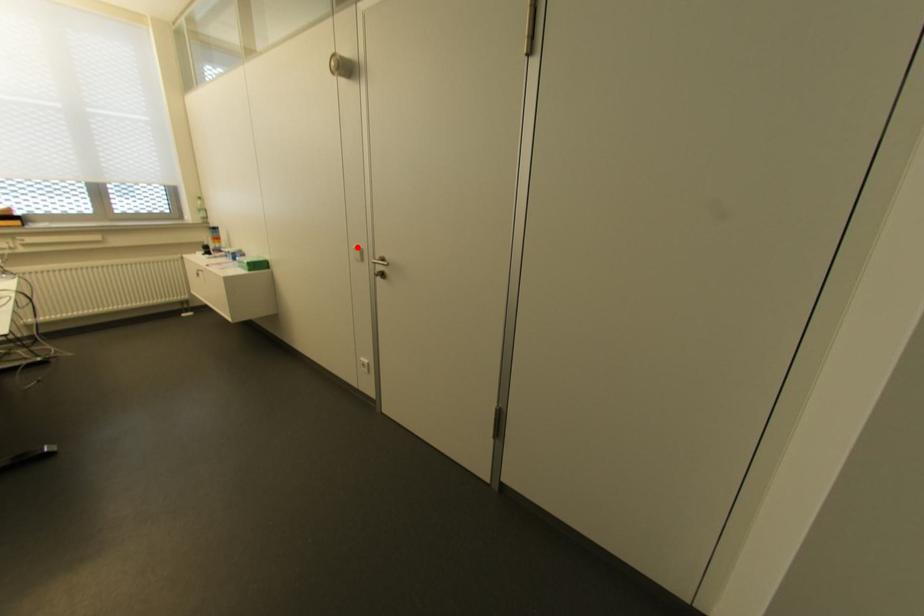
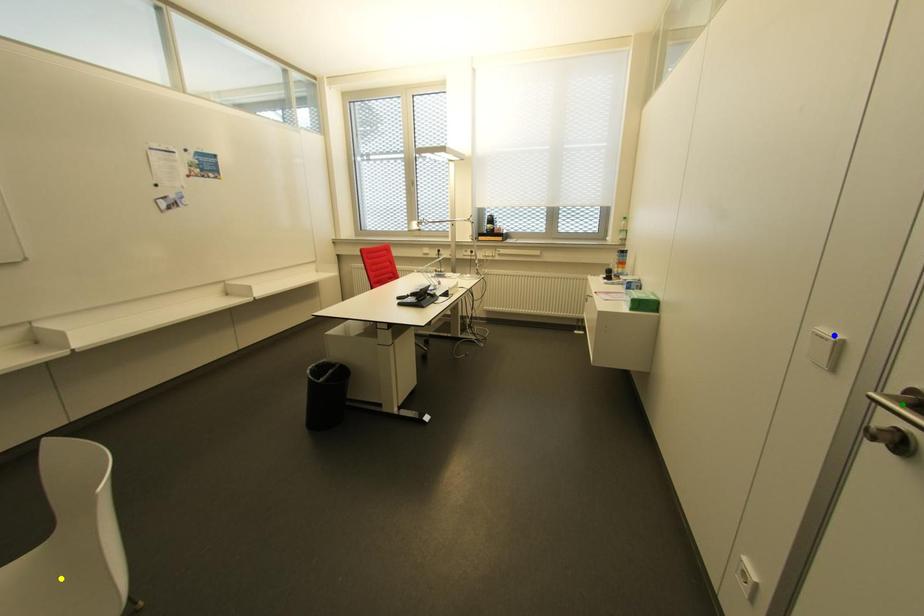
Question: I am providing you with two images of the same scene from different viewpoints. A red point is marked on the first image. You are given multiple points on the second image. Which mark in image 2 goes with the point in image 1?

Choices:
 (A) green point
 (B) yellow point
 (C) blue point

Answer: (C)